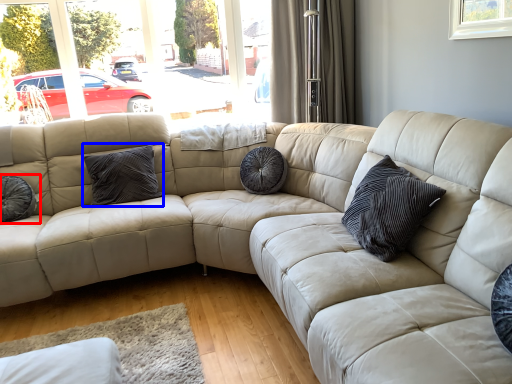
Question: Which object appears farthest to the camera in this image, pillow (highlighted by a red box) or pillow (highlighted by a blue box)?

Choices:
 (A) pillow
 (B) pillow

Answer: (B)